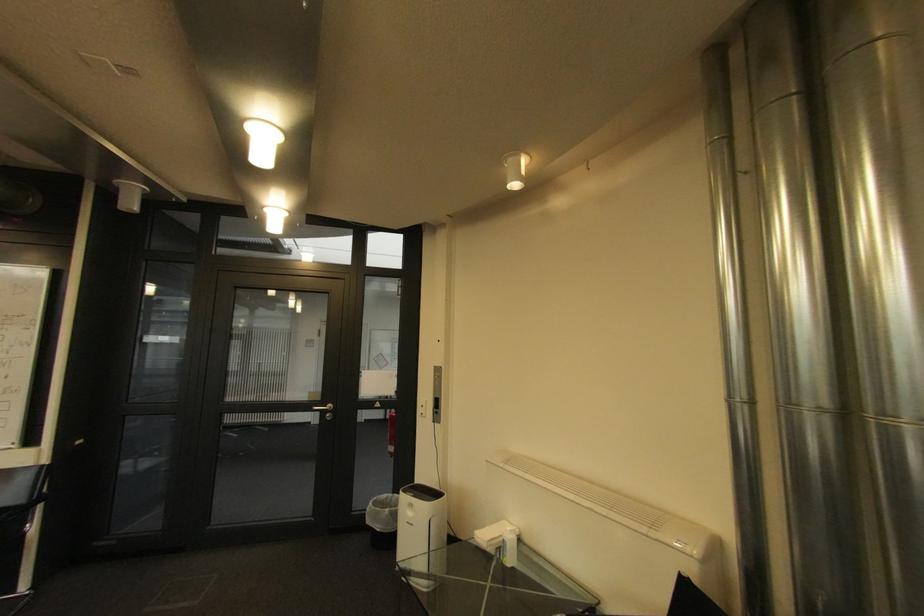
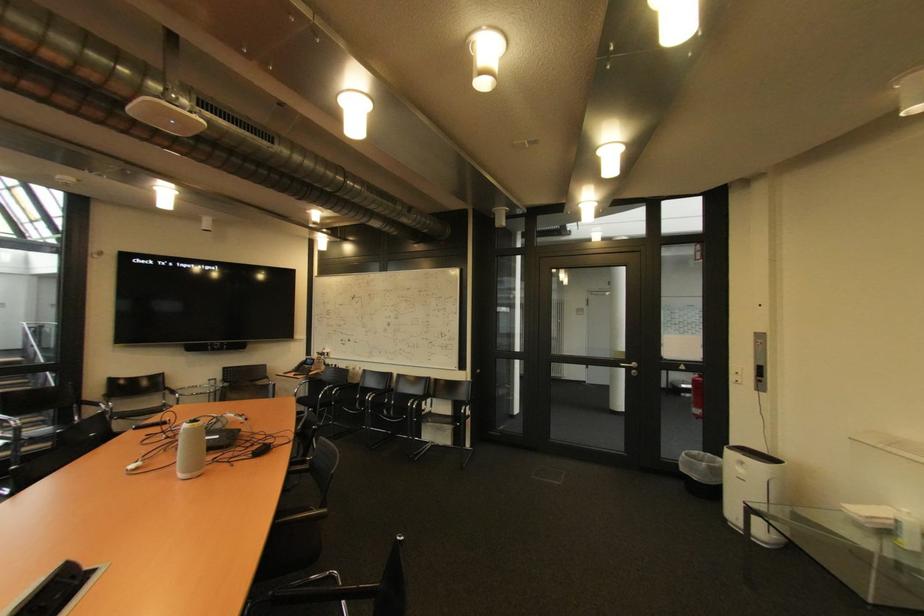
Where in the second image is the point corresponding to the point at 377,523 from the first image?

(690, 471)